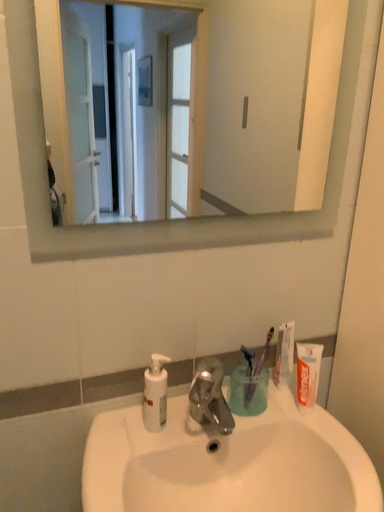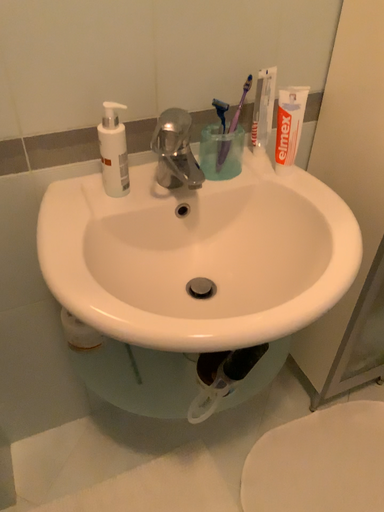
Question: How did the camera likely rotate when shooting the video?

Choices:
 (A) rotated downward
 (B) rotated upward

Answer: (A)